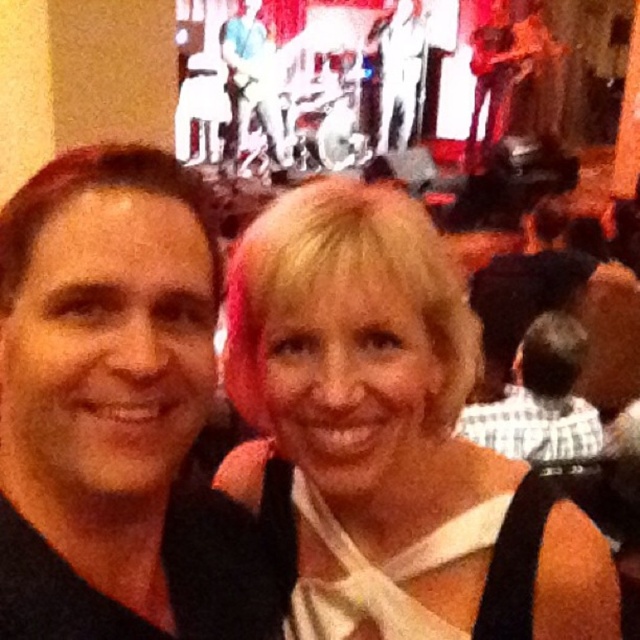
You are a photographer at the event and want to ensure both the blonde hair at center and the white checkered shirt at center are clearly visible in your photo. Given that your camera can only focus on objects wider than 10 cm, can both objects meet this requirement?

The blonde hair at center is wider than the white checkered shirt at center. Since the camera requires objects to be wider than 10 cm, we need to confirm if both meet this. However, the description only states their relative widths, not absolute measurements. Therefore, it is uncertain if both objects individually exceed 10 cm in width.

You are a photographer at a social event and want to capture a clear photo of the blonde hair at center and the white checkered shirt at center. The camera you are using has a minimum focus distance of 5 feet. Can you take a clear photo of both objects without moving the camera?

The blonde hair at center is 4.94 feet away from the white checkered shirt at center. Since the minimum focus distance is 5 feet, the camera cannot focus on both objects as they are closer than the required distance.

You are at a social event and want to take a photo of the two people in the center. The blonde hair at center and the white checkered shirt at center are both in the frame. Based on their positions, which one is closer to the bottom of the photo?

The blonde hair at center is below the white checkered shirt at center, so the blonde hair at center is closer to the bottom of the photo.